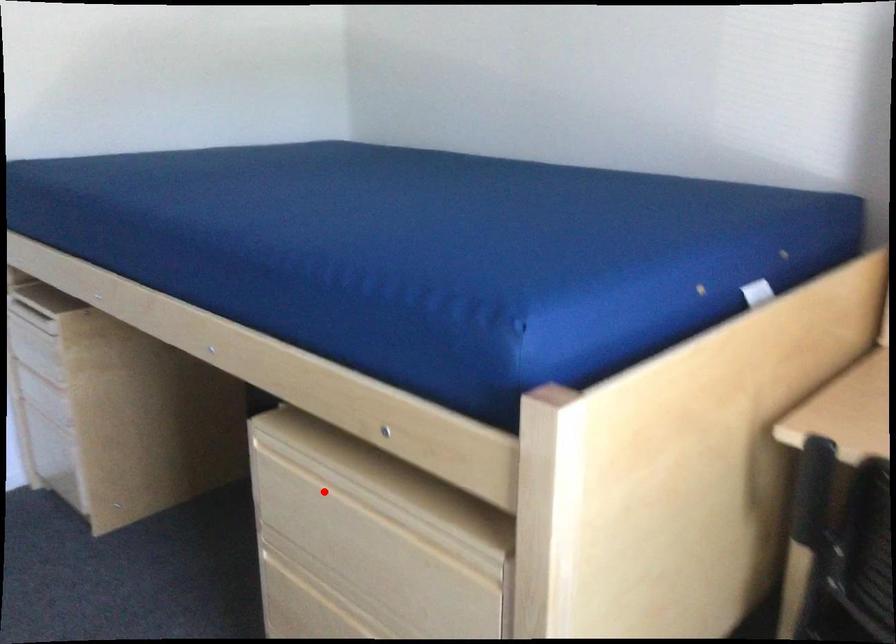
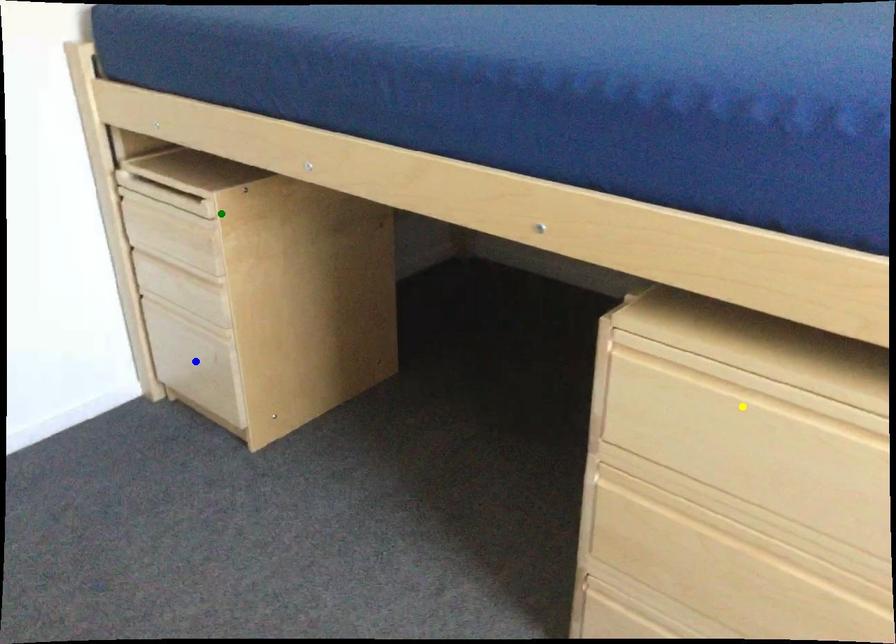
Question: I am providing you with two images of the same scene from different viewpoints. A red point is marked on the first image. You are given multiple points on the second image. Which spot in image 2 lines up with the point in image 1?

Choices:
 (A) yellow point
 (B) blue point
 (C) green point

Answer: (A)